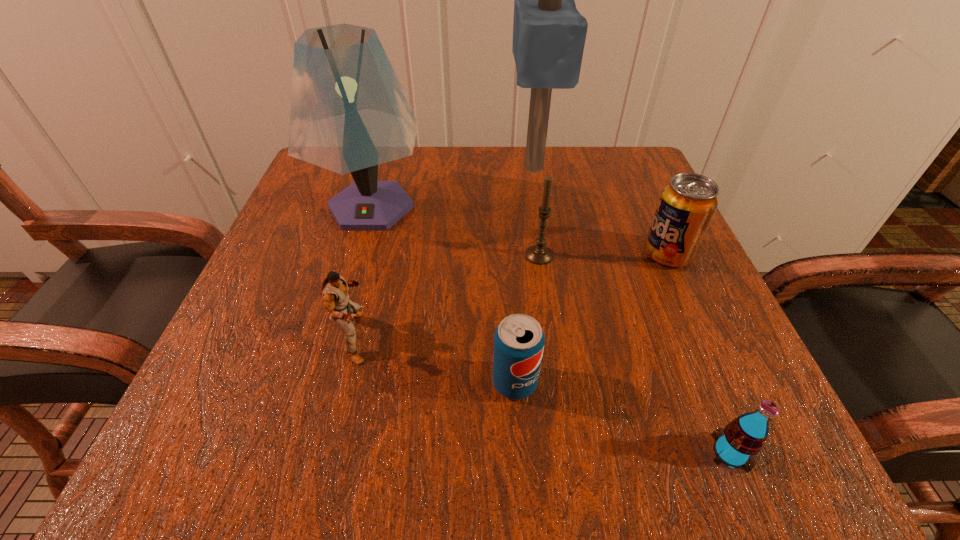
In the image, there is a desktop. Find the location of `vacant space at the far edge`. vacant space at the far edge is located at coordinates tap(539, 173).

Identify the location of vacant space at the near edge of the desktop. The width and height of the screenshot is (960, 540). (478, 430).

Where is `vacant space at the left edge of the desktop`? The height and width of the screenshot is (540, 960). vacant space at the left edge of the desktop is located at coordinates (358, 242).

The image size is (960, 540). I want to click on vacant space at the right edge of the desktop, so click(x=698, y=350).

The width and height of the screenshot is (960, 540). Find the location of `vacant point at the near left corner`. vacant point at the near left corner is located at coordinates (208, 427).

The height and width of the screenshot is (540, 960). Find the location of `vacant area at the far right corner of the desktop`. vacant area at the far right corner of the desktop is located at coordinates (649, 181).

You are a GUI agent. You are given a task and a screenshot of the screen. Output one action in this format:
    pyautogui.click(x=<x>, y=<y>)
    Task: Click on the free space at the near right corner of the desktop
    The width and height of the screenshot is (960, 540).
    Given the screenshot: What is the action you would take?
    pyautogui.click(x=701, y=433)

This screenshot has height=540, width=960. What are the coordinates of `vacant area that lies between the mallet and the lampshade` in the screenshot? It's located at (452, 187).

Locate an element on the screen. Image resolution: width=960 pixels, height=540 pixels. vacant area between the mallet and the candle is located at coordinates (537, 211).

You are a GUI agent. You are given a task and a screenshot of the screen. Output one action in this format:
    pyautogui.click(x=<x>, y=<y>)
    Task: Click on the free point between the lampshade and the puncher
    This screenshot has width=960, height=540.
    Given the screenshot: What is the action you would take?
    pyautogui.click(x=363, y=272)